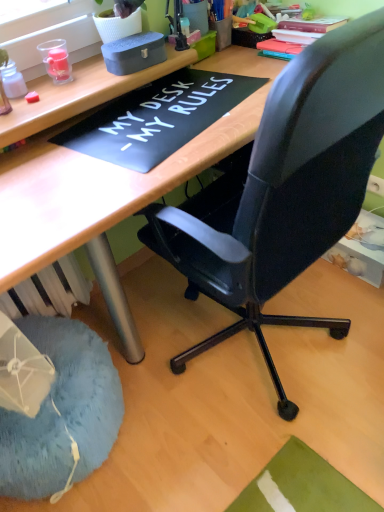
Question: Is there a large distance between blue fuzzy bean bag at lower left and translucent plastic bottle at upper left, which is the second stationery from right to left?

Choices:
 (A) yes
 (B) no

Answer: (B)

Question: From the image's perspective, is blue fuzzy bean bag at lower left under translucent plastic bottle at upper left, which is the 1th stationery in left-to-right order?

Choices:
 (A) no
 (B) yes

Answer: (B)

Question: From a real-world perspective, does blue fuzzy bean bag at lower left sit lower than translucent plastic bottle at upper left, which is the 1th stationery in left-to-right order?

Choices:
 (A) yes
 (B) no

Answer: (A)

Question: Considering the relative sizes of blue fuzzy bean bag at lower left and translucent plastic bottle at upper left, which is the second stationery from right to left, in the image provided, is blue fuzzy bean bag at lower left smaller than translucent plastic bottle at upper left, which is the second stationery from right to left,?

Choices:
 (A) yes
 (B) no

Answer: (B)

Question: Is blue fuzzy bean bag at lower left positioned in front of translucent plastic bottle at upper left, which is the 1th stationery in left-to-right order?

Choices:
 (A) yes
 (B) no

Answer: (A)

Question: Does blue fuzzy bean bag at lower left have a greater width compared to translucent plastic bottle at upper left, which is the 1th stationery in left-to-right order?

Choices:
 (A) no
 (B) yes

Answer: (B)

Question: From a real-world perspective, is matte gray box at upper center, positioned as the first stationery in right-to-left order, beneath wooden desk at center?

Choices:
 (A) no
 (B) yes

Answer: (A)

Question: Is matte gray box at upper center, the 2th stationery from the left, thinner than wooden desk at center?

Choices:
 (A) no
 (B) yes

Answer: (B)

Question: From the image's perspective, is matte gray box at upper center, the 2th stationery from the left, located above wooden desk at center?

Choices:
 (A) yes
 (B) no

Answer: (A)

Question: Considering the relative positions of matte gray box at upper center, the 2th stationery from the left, and wooden desk at center in the image provided, is matte gray box at upper center, the 2th stationery from the left, to the left of wooden desk at center from the viewer's perspective?

Choices:
 (A) no
 (B) yes

Answer: (B)

Question: Can you confirm if matte gray box at upper center, the 2th stationery from the left, is bigger than wooden desk at center?

Choices:
 (A) yes
 (B) no

Answer: (B)

Question: Does matte gray box at upper center, positioned as the first stationery in right-to-left order, appear on the right side of wooden desk at center?

Choices:
 (A) no
 (B) yes

Answer: (A)

Question: From a real-world perspective, is wooden desk at center beneath matte gray box at upper center, the 2th stationery from the left?

Choices:
 (A) yes
 (B) no

Answer: (A)